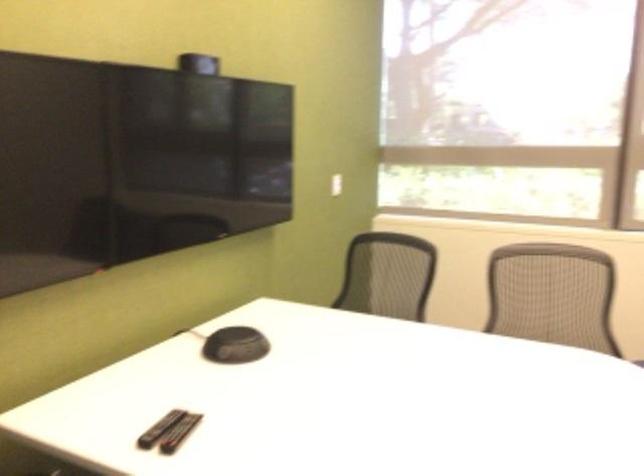
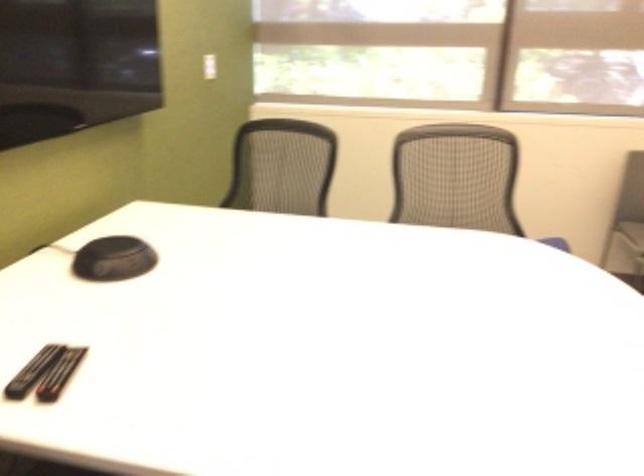
In a continuous first-person perspective shot, in which direction is the camera moving?

The movement direction of the cameraman is left, forward.